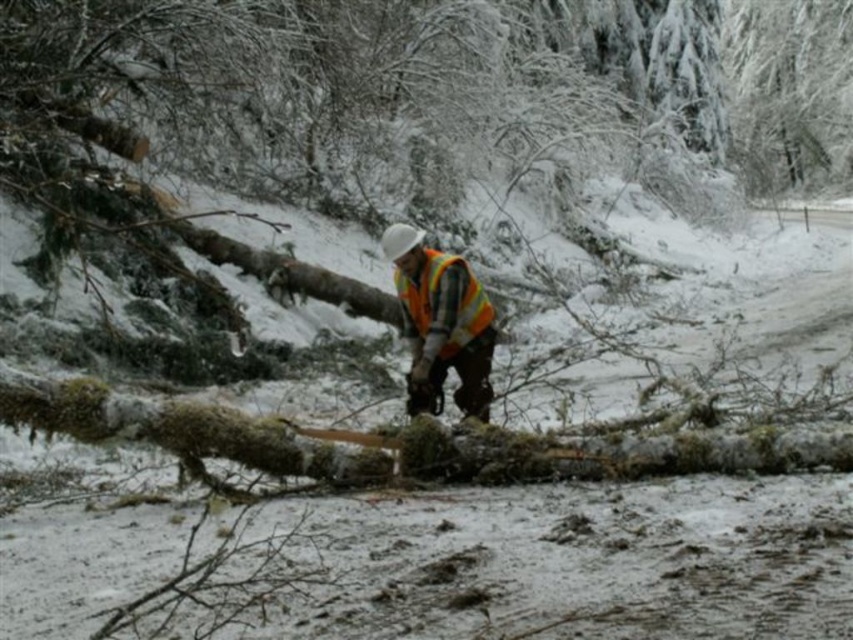
Between orange reflective vest at center and reflective orange safety vest at center, which one has less height?

Standing shorter between the two is reflective orange safety vest at center.

Does orange reflective vest at center have a greater width compared to reflective orange safety vest at center?

Yes, orange reflective vest at center is wider than reflective orange safety vest at center.

Which is in front, point (489, 336) or point (424, 314)?

Point (424, 314) is in front.

You are a GUI agent. You are given a task and a screenshot of the screen. Output one action in this format:
    pyautogui.click(x=<x>, y=<y>)
    Task: Click on the orange reflective vest at center
    This screenshot has width=853, height=640.
    Given the screenshot: What is the action you would take?
    pyautogui.click(x=440, y=323)